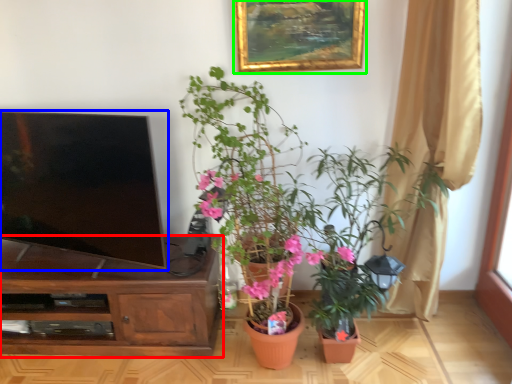
Question: Estimate the real-world distances between objects in this image. Which object is farther from cabinetry (highlighted by a red box), television (highlighted by a blue box) or picture frame (highlighted by a green box)?

Choices:
 (A) television
 (B) picture frame

Answer: (B)